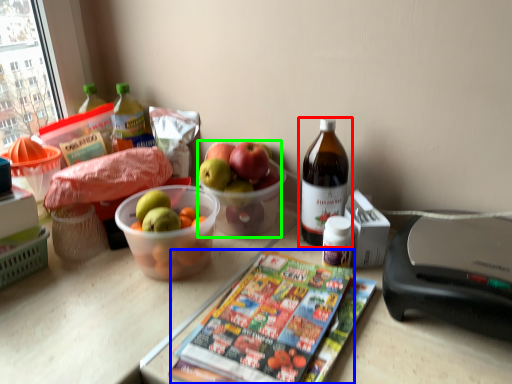
Question: Which object is positioned farthest from bottle (highlighted by a red box)? Select from magazine (highlighted by a blue box) and grapefruit (highlighted by a green box).

Choices:
 (A) magazine
 (B) grapefruit

Answer: (A)